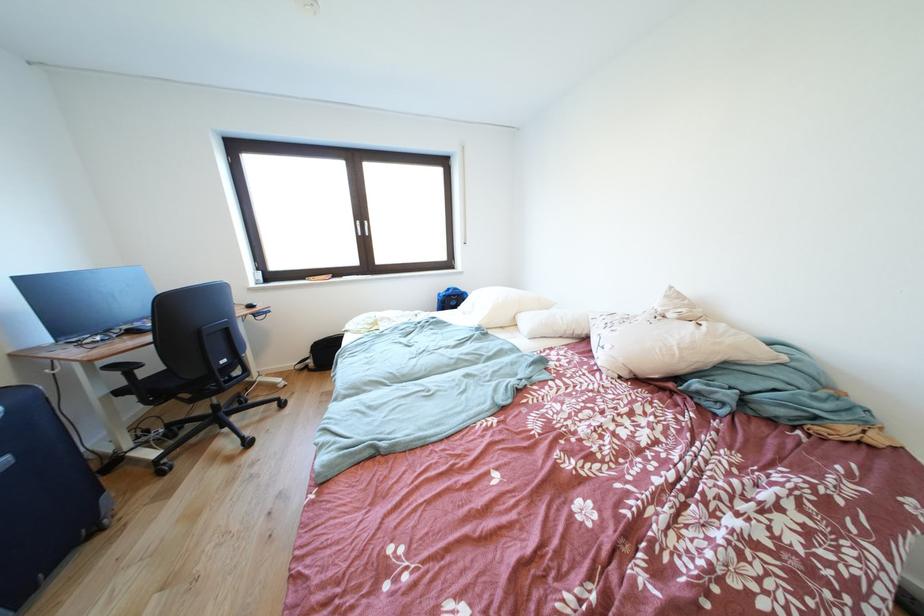
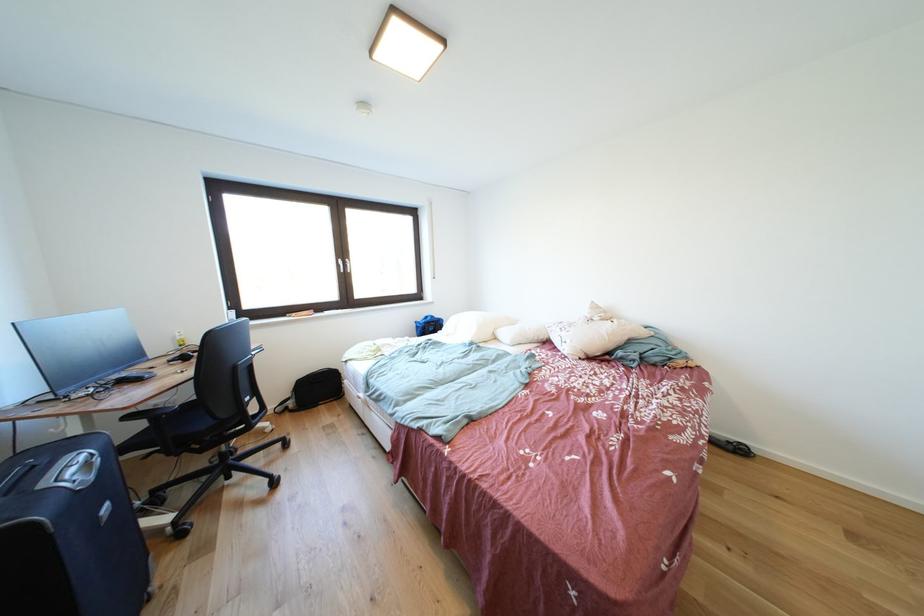
The point at (x=470, y=294) is marked in the first image. Where is the corresponding point in the second image?

(445, 321)